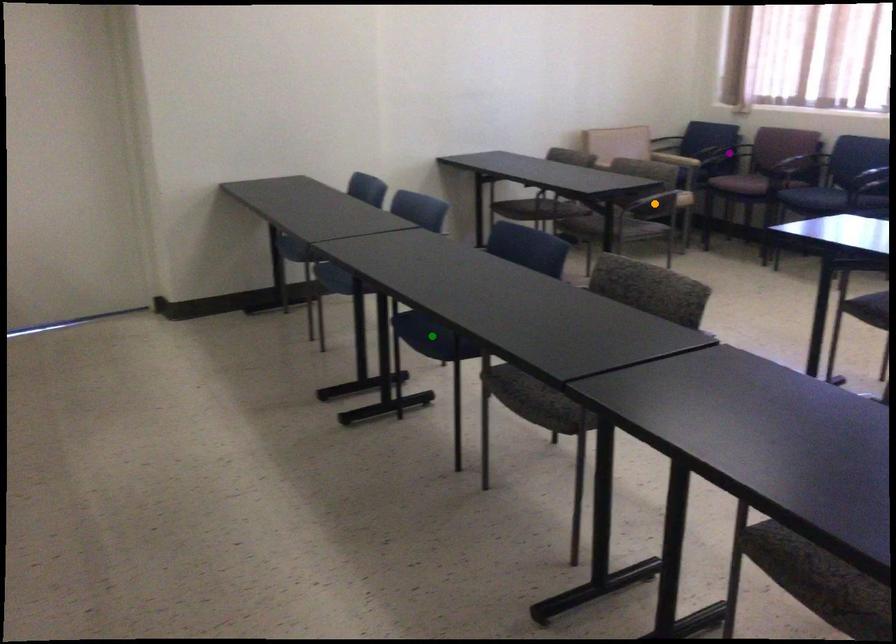
Order these from nearest to farthest:
A) orange point
B) green point
C) purple point

green point, orange point, purple point